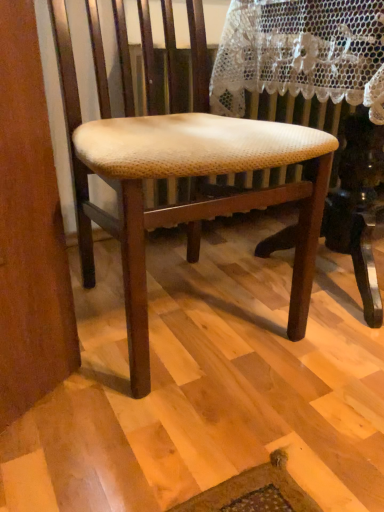
Describe the element at coordinates (181, 169) in the screenshot. The image size is (384, 512). I see `wooden cane seat at center` at that location.

This screenshot has height=512, width=384. Identify the location of wooden cane seat at center. (181, 169).

Locate an element on the screen. This screenshot has width=384, height=512. wooden cane seat at center is located at coordinates (181, 169).